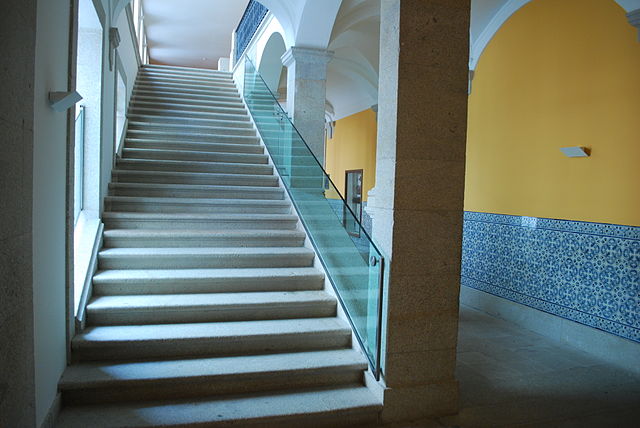
Where is `ceiling`? ceiling is located at coordinates (180, 29).